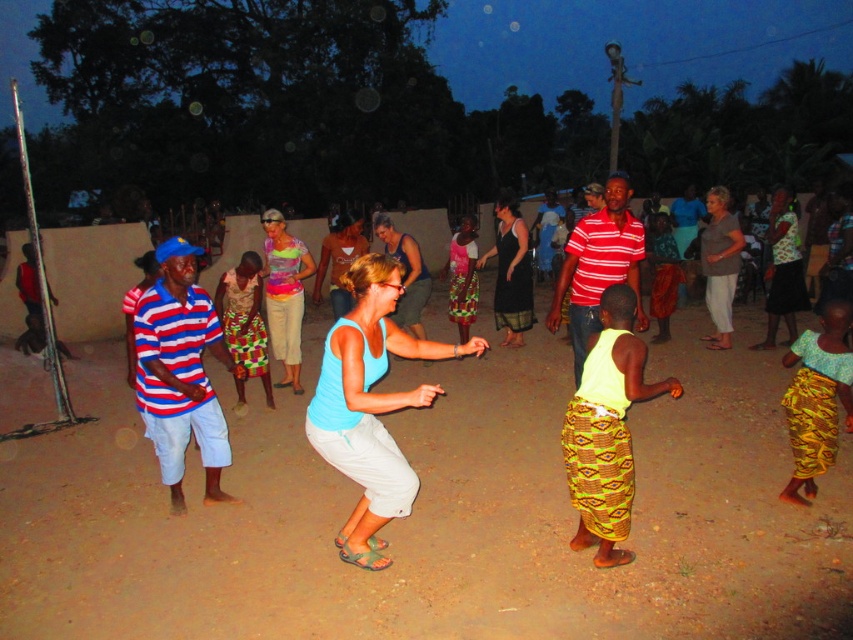
Question: Which point is farther from the camera taking this photo?

Choices:
 (A) (277, 230)
 (B) (155, 445)
 (C) (612, 532)
 (D) (613, 268)

Answer: (A)

Question: Which point is farther to the camera?

Choices:
 (A) brown sandy ground at center
 (B) multicolored fabric dress at center
 (C) striped cotton shirt at center
 (D) blue fabric tank top at center

Answer: (B)

Question: Which object is positioned farthest from the striped cotton shirt at center?

Choices:
 (A) blue fabric tank top at center
 (B) striped cotton shirt at left

Answer: (B)

Question: Is blue fabric tank top at center to the right of striped cotton shirt at left from the viewer's perspective?

Choices:
 (A) no
 (B) yes

Answer: (B)

Question: Does striped cotton shirt at left have a smaller size compared to yellow printed skirt at center?

Choices:
 (A) no
 (B) yes

Answer: (A)

Question: Does brown sandy ground at center appear on the left side of multicolored fabric dress at center?

Choices:
 (A) yes
 (B) no

Answer: (B)